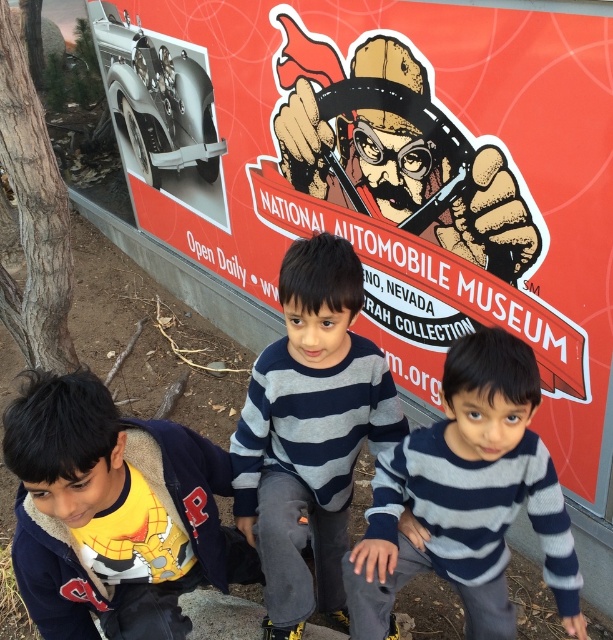
From the picture: Is striped sweater at center shorter than black ink pen at upper center?

Indeed, striped sweater at center has a lesser height compared to black ink pen at upper center.

Is point (552, 561) in front of point (511, 268)?

That is True.

I want to click on striped sweater at center, so click(x=466, y=497).

Is red matte sign at center to the right of gray striped sweater at center from the viewer's perspective?

In fact, red matte sign at center is to the left of gray striped sweater at center.

Can you confirm if red matte sign at center is taller than gray striped sweater at center?

Yes, red matte sign at center is taller than gray striped sweater at center.

Measure the distance between red matte sign at center and camera.

The distance of red matte sign at center from camera is 5.19 feet.

Where is `red matte sign at center`? This screenshot has height=640, width=613. red matte sign at center is located at coordinates [392, 172].

Looking at this image, is gray striped sweater at center bigger than black ink pen at upper center?

Incorrect, gray striped sweater at center is not larger than black ink pen at upper center.

Is gray striped sweater at center closer to the viewer compared to black ink pen at upper center?

Yes, it is in front of black ink pen at upper center.

This screenshot has width=613, height=640. What do you see at coordinates (310, 433) in the screenshot? I see `gray striped sweater at center` at bounding box center [310, 433].

Where is `gray striped sweater at center`? Image resolution: width=613 pixels, height=640 pixels. gray striped sweater at center is located at coordinates (310, 433).